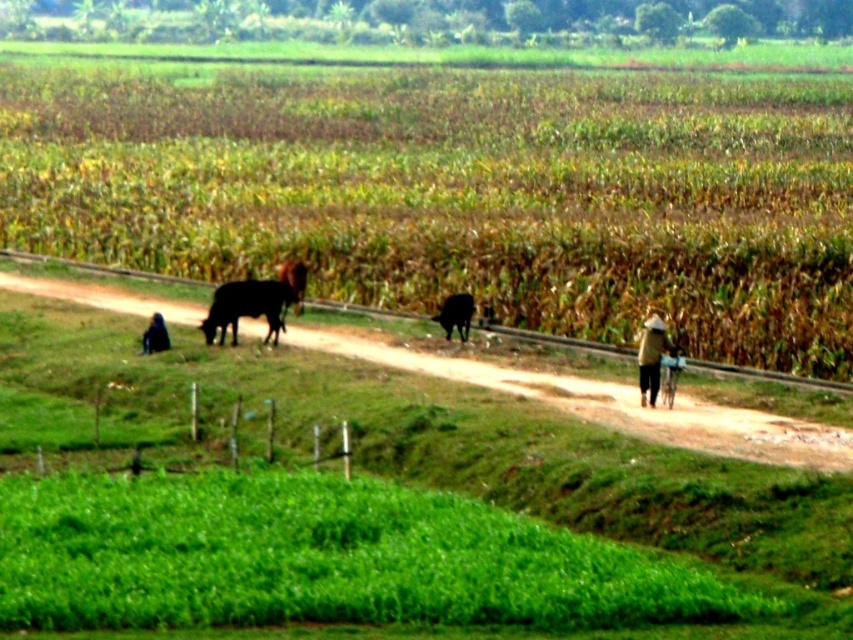
Question: From the image, what is the correct spatial relationship of shiny brown cow at center in relation to black glossy cow at center?

Choices:
 (A) above
 (B) below

Answer: (B)

Question: Can you confirm if brown grassy corn field at center is positioned to the right of light brown woven hat at right?

Choices:
 (A) no
 (B) yes

Answer: (A)

Question: Does brown grassy corn field at center lie in front of shiny brown cow at center?

Choices:
 (A) no
 (B) yes

Answer: (B)

Question: Among these objects, which one is nearest to the camera?

Choices:
 (A) light brown woven hat at right
 (B) brown grassy corn field at center
 (C) black fur cow at center

Answer: (A)

Question: Which point is farther to the camera?

Choices:
 (A) black fur cow at center
 (B) brown grassy corn field at center

Answer: (A)

Question: Which of the following is the closest to the observer?

Choices:
 (A) black glossy cow at left
 (B) shiny brown cow at center
 (C) brown grassy corn field at center
 (D) light brown woven hat at right

Answer: (D)